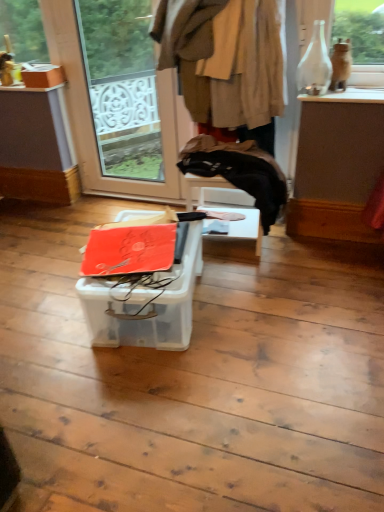
The height and width of the screenshot is (512, 384). In order to click on free space above white glossy vase at upper right (from a real-world perspective) in this screenshot , I will do `click(354, 90)`.